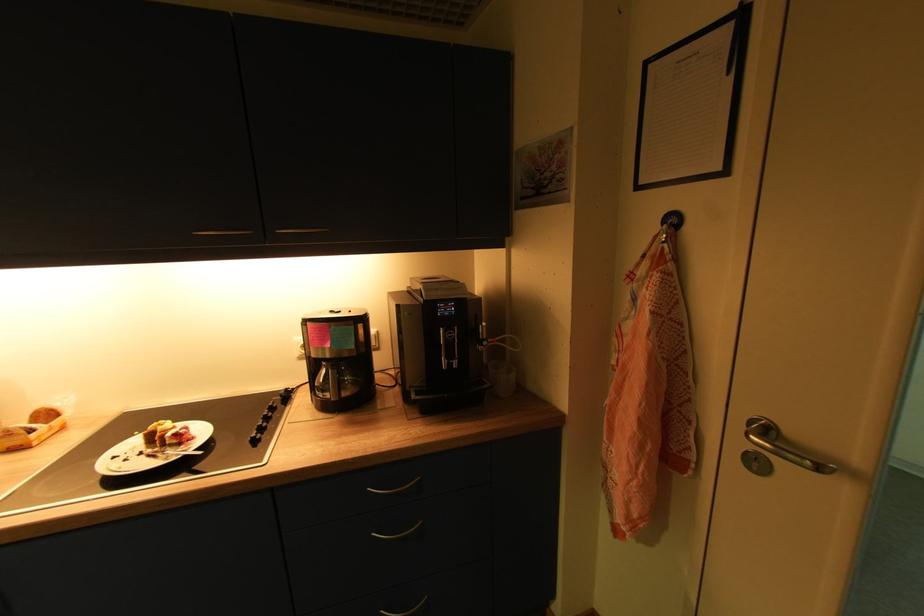
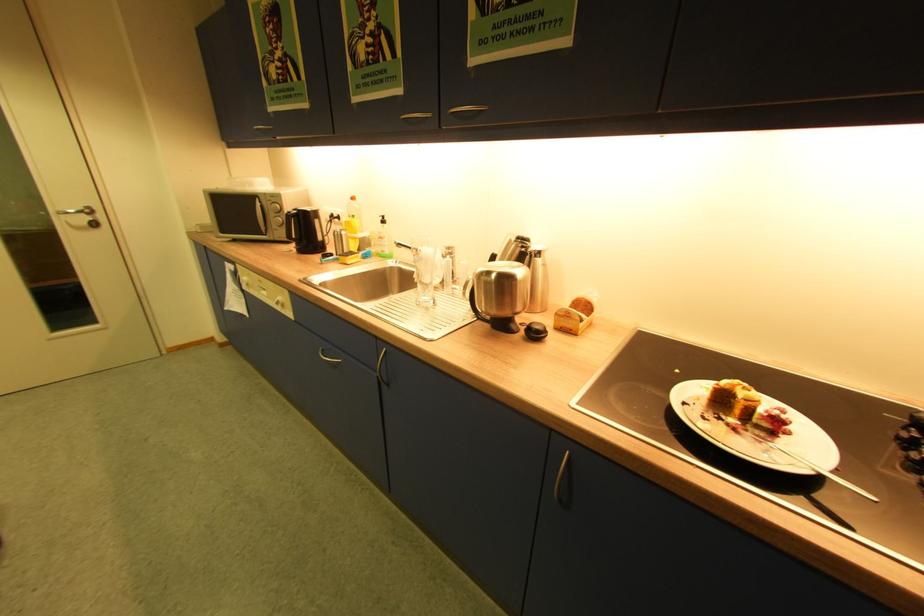
Locate, in the second image, the point that corresponds to pixel 54 415 in the first image.

(590, 306)